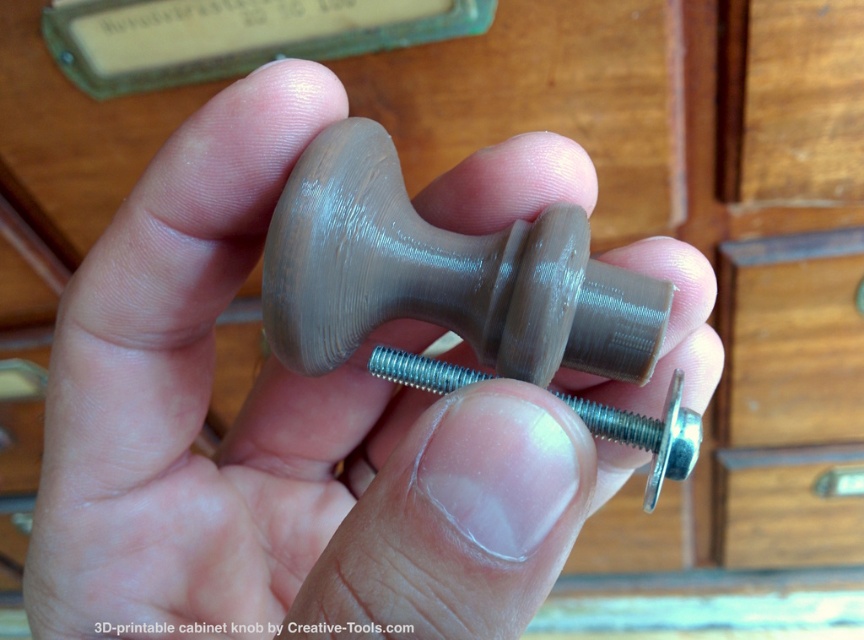
Where is the matte brown knob at center located in the image?

The matte brown knob at center is located at point (277, 435) in the image.

Please look at the image. There is a point marked at coordinates (277, 435). Based on the description, which object is this point located on? The options are the matte brown knob at center or the metallic screw with hexagonal head attached to it.

The point at coordinates (277, 435) is located on the matte brown knob at center, as stated in the objects description.

Based on the photo, you are a carpenter trying to install a new cabinet knob. You have the matte brown knob at center and the satin silver metallic bolt at center. Which object should you focus on adjusting if you want to change the height of the knob?

The satin silver metallic bolt at center should be adjusted because the matte brown knob at center is much taller than the bolt, so adjusting the bolt would allow you to modify the knob height.